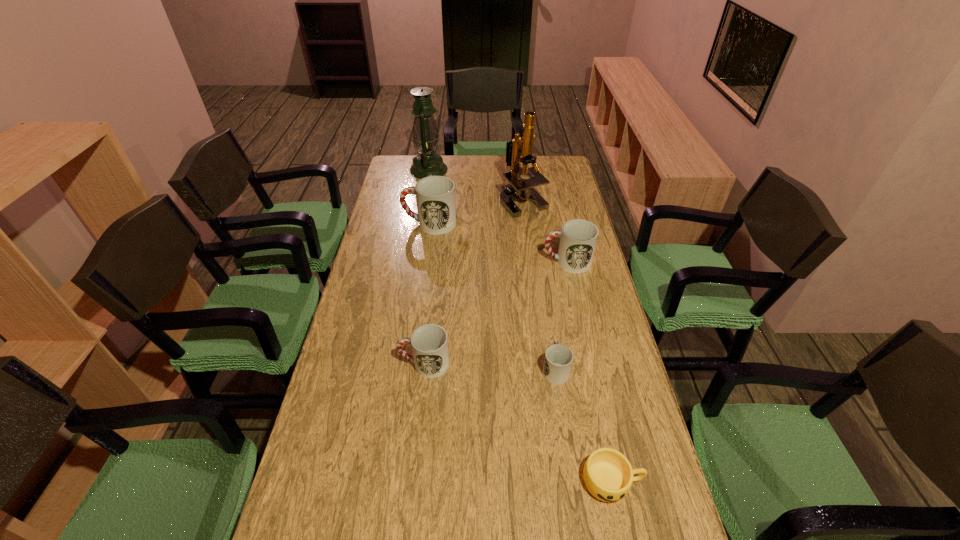
At what (x,y) coordinates should I click in order to perform the action: click on the nearest object. Please return your answer as a coordinate pair (x, y). Looking at the image, I should click on (608, 475).

What are the coordinates of `the shortest cup` in the screenshot? It's located at (608, 475).

This screenshot has height=540, width=960. What are the coordinates of `free space located 0.050m on the front of the farthest object` in the screenshot? It's located at (425, 186).

Find the location of a particular element. vacant space positioned 0.050m at the eyepiece of the microscope is located at coordinates point(526,226).

Image resolution: width=960 pixels, height=540 pixels. I want to click on free point located 0.080m on the side of the third tallest object where the handle is located, so click(383, 224).

Identify the location of free location located 0.370m on the side of the third nearest red cup where the handle is located. The image size is (960, 540). (442, 262).

The width and height of the screenshot is (960, 540). Identify the location of vacant region located on the side of the third nearest red cup where the handle is located. (491, 262).

This screenshot has height=540, width=960. What are the coordinates of `free region located on the side of the third nearest red cup where the handle is located` in the screenshot? It's located at (515, 262).

At what (x,y) coordinates should I click in order to perform the action: click on vacant point located 0.170m on the side of the fifth tallest object where the handle is located. Please return your answer as a coordinate pair (x, y). The height and width of the screenshot is (540, 960). Looking at the image, I should click on (342, 363).

I want to click on blank area located on the side of the fifth tallest object where the handle is located, so click(348, 363).